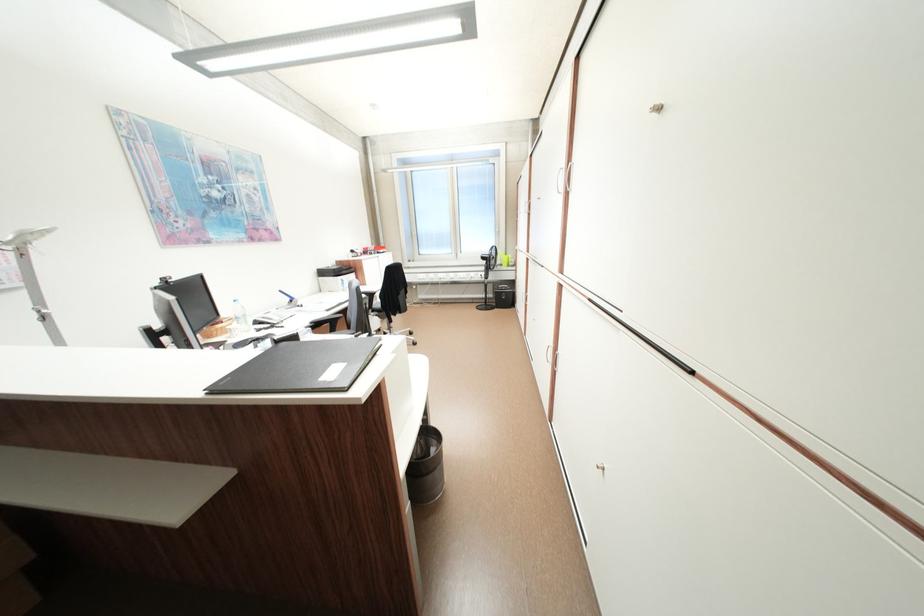
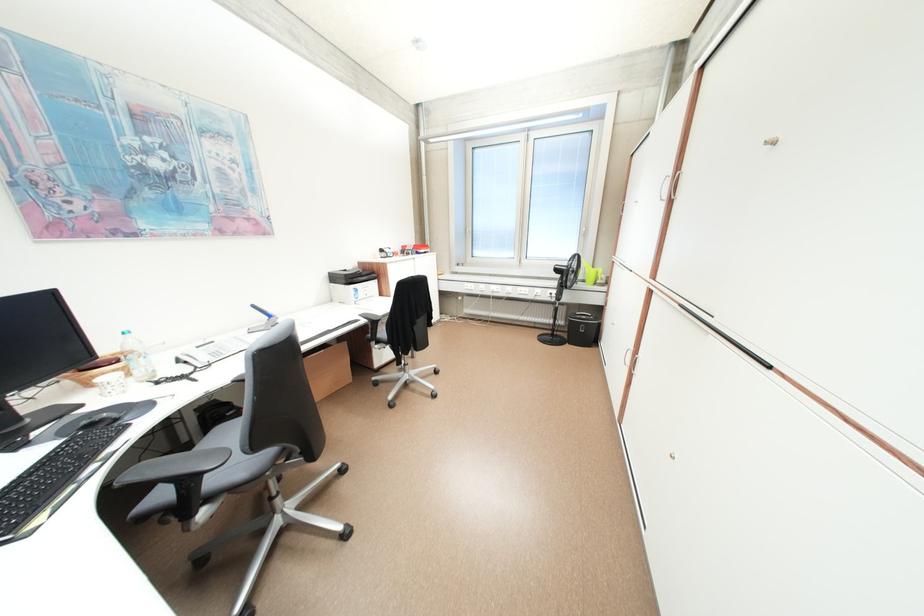
Find the pixel in the second image that matches (266,323) in the first image.

(188, 362)